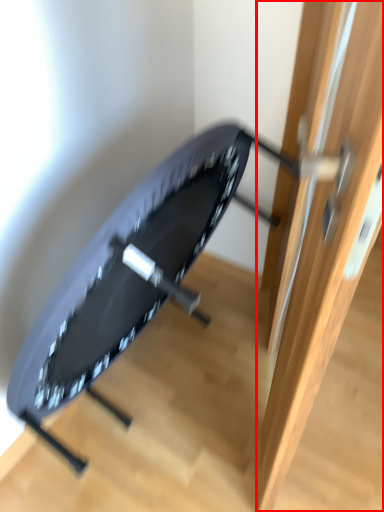
Question: Where is door (annotated by the red box) located in relation to swivel chair in the image?

Choices:
 (A) left
 (B) right

Answer: (B)